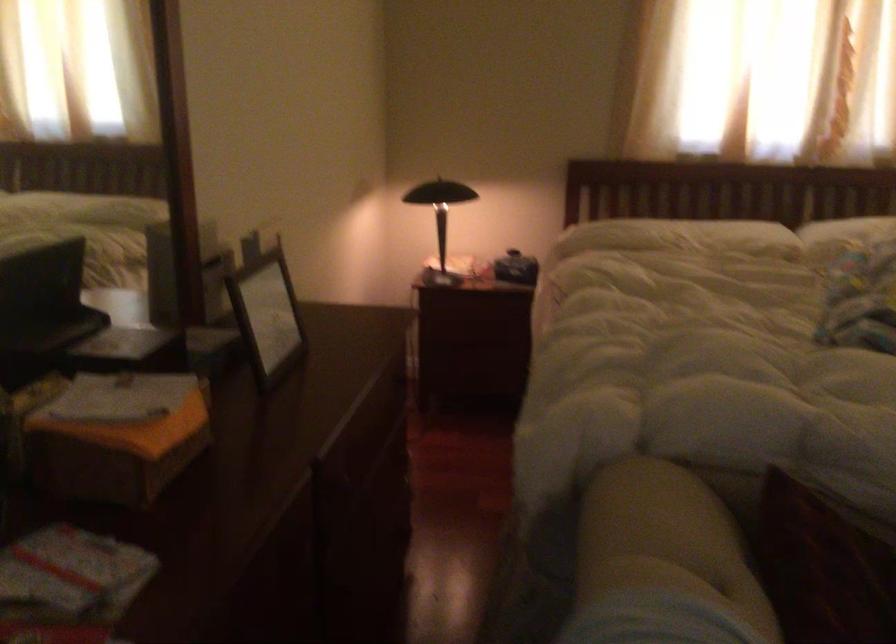
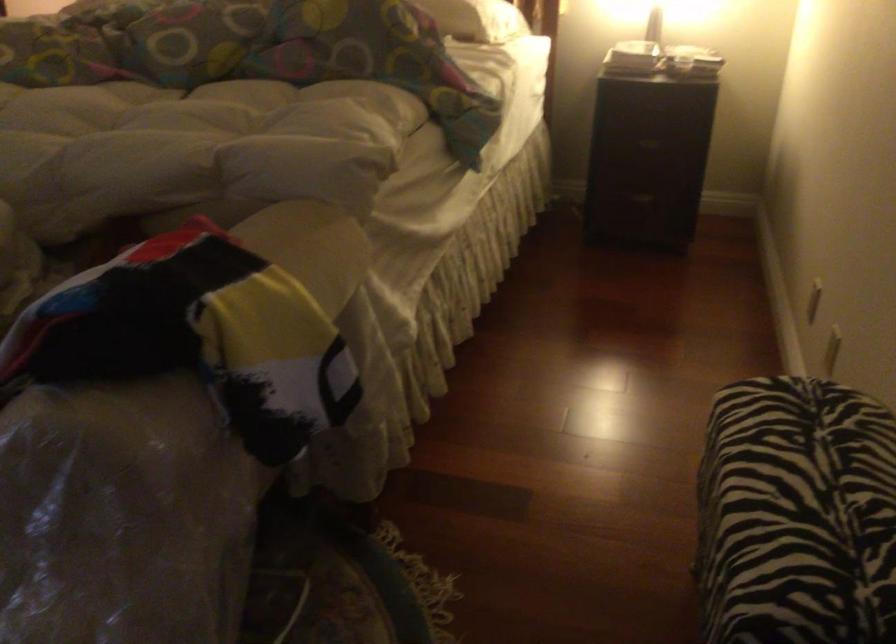
Question: What movement of the cameraman would produce the second image?

Choices:
 (A) Left
 (B) Right
 (C) Forward
 (D) Backward

Answer: (B)